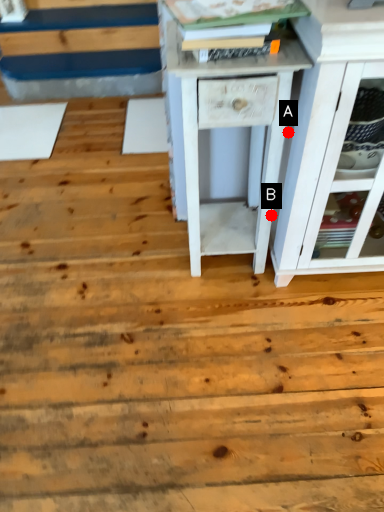
Question: Two points are circled on the image, labeled by A and B beside each circle. Among these points, which one is farthest from the camera?

Choices:
 (A) A is further
 (B) B is further

Answer: (B)